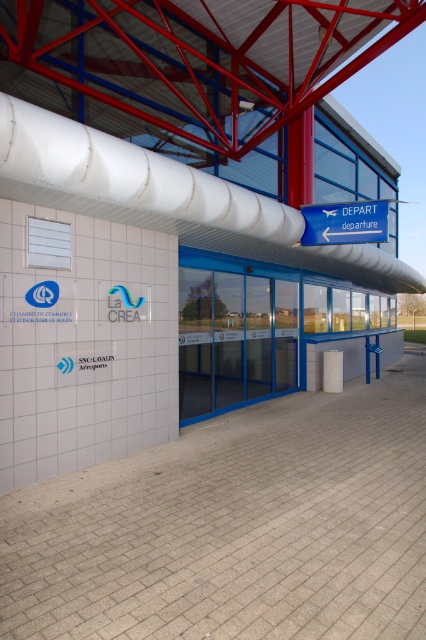
Is point (351, 240) farther from viewer compared to point (336, 371)?

No.

Is point (342, 232) positioned in front of point (337, 365)?

Yes, it is.

The width and height of the screenshot is (426, 640). Describe the element at coordinates (345, 221) in the screenshot. I see `blue plastic sign at upper center` at that location.

The image size is (426, 640). I want to click on blue plastic sign at upper center, so click(x=345, y=221).